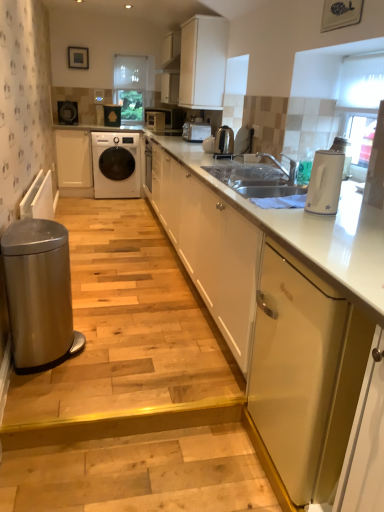
Locate an element on the screen. Image resolution: width=384 pixels, height=512 pixels. free point to the right of satin nickel kettle at center is located at coordinates (246, 159).